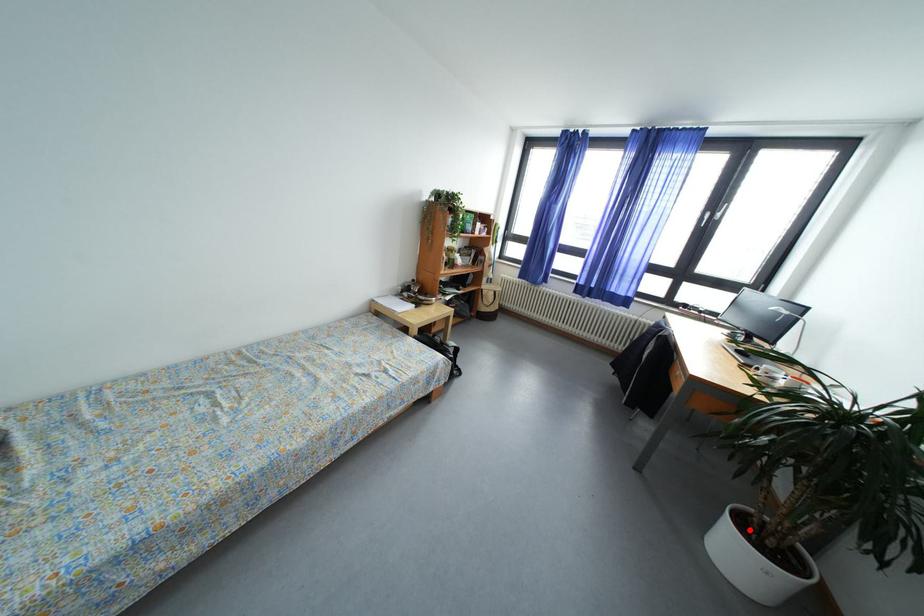
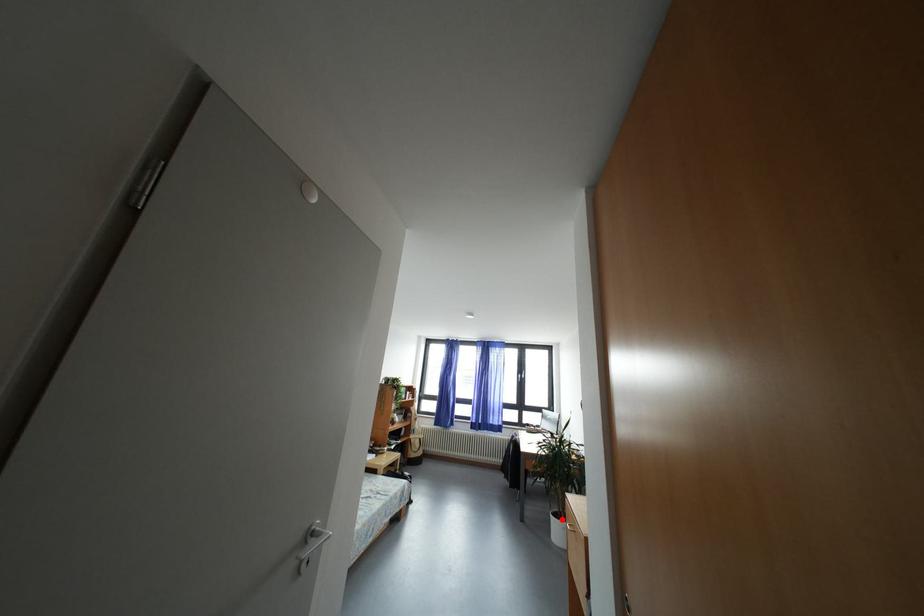
I am providing you with two images of the same scene from different viewpoints. A red point is marked on the first image and another point is marked on the second image. Does the point marked in image1 correspond to the same location as the one in image2?

Yes